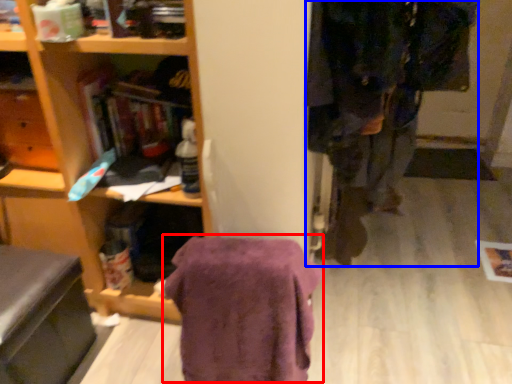
Question: Among these objects, which one is farthest to the camera, blanket (highlighted by a red box) or clothing (highlighted by a blue box)?

Choices:
 (A) blanket
 (B) clothing

Answer: (A)